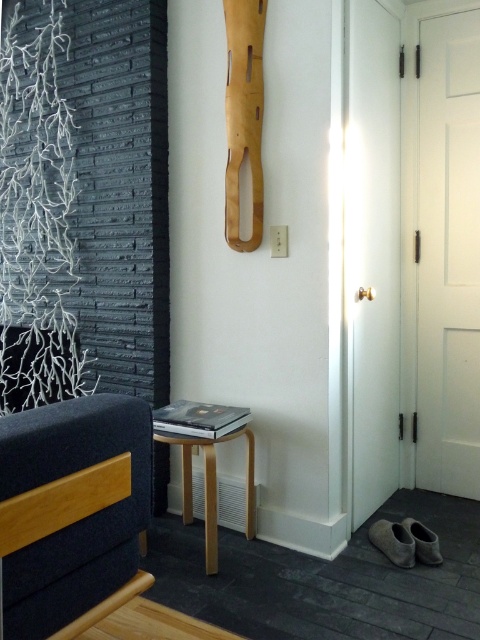
Question: Which point is farther to the camera?

Choices:
 (A) (184, 451)
 (B) (79, 490)

Answer: (A)

Question: Which point is farther from the camera taking this photo?

Choices:
 (A) (206, 445)
 (B) (110, 458)

Answer: (A)

Question: In this image, where is dark blue fabric couch at lower left located relative to light wood/veneer side table at lower center?

Choices:
 (A) below
 (B) above

Answer: (B)

Question: Is dark blue fabric couch at lower left in front of light wood/veneer side table at lower center?

Choices:
 (A) yes
 (B) no

Answer: (A)

Question: Is dark blue fabric couch at lower left in front of light wood/veneer side table at lower center?

Choices:
 (A) no
 (B) yes

Answer: (B)